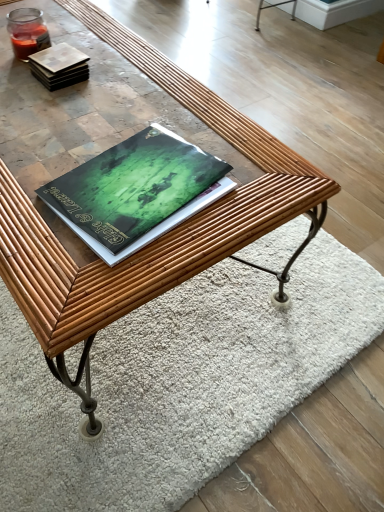
Where is `free space that is to the left of matte brown tile at upper left, marked as the first book in a top-to-bottom arrangement`? This screenshot has height=512, width=384. free space that is to the left of matte brown tile at upper left, marked as the first book in a top-to-bottom arrangement is located at coordinates (17, 76).